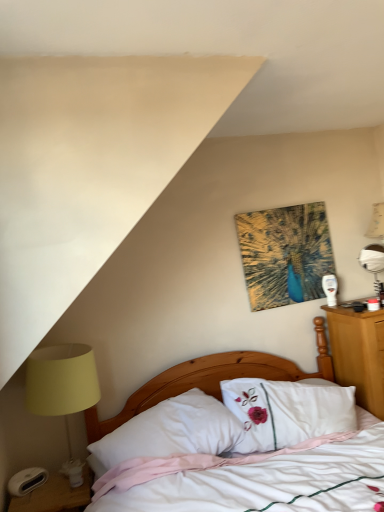
Question: Is point (203, 449) positioned closer to the camera than point (67, 349)?

Choices:
 (A) farther
 (B) closer

Answer: (B)

Question: In the image, is white soft pillow at center positioned in front of or behind matte yellow lampshade at left?

Choices:
 (A) behind
 (B) front

Answer: (B)

Question: Which object is positioned farthest from the white soft pillow at center?

Choices:
 (A) white matte bed at center
 (B) abstract painting at upper center
 (C) matte yellow lampshade at left
 (D) metallic silver table lamp at right
 (E) white glossy nightstand at lower left

Answer: (D)

Question: Estimate the real-world distances between objects in this image. Which object is closer to the abstract painting at upper center?

Choices:
 (A) white glossy nightstand at lower left
 (B) white matte bed at center
 (C) metallic silver table lamp at right
 (D) white soft pillow at center
 (E) matte yellow lampshade at left

Answer: (B)